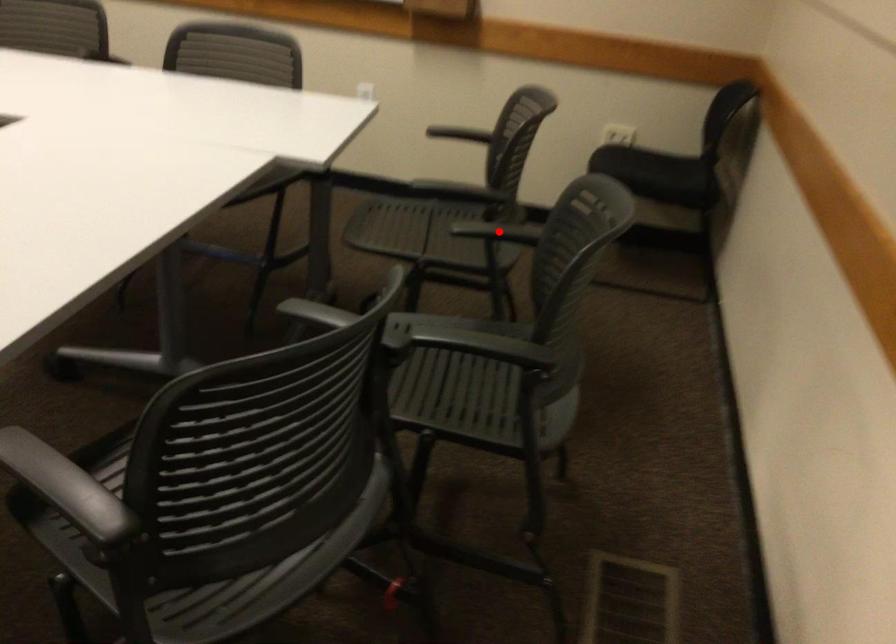
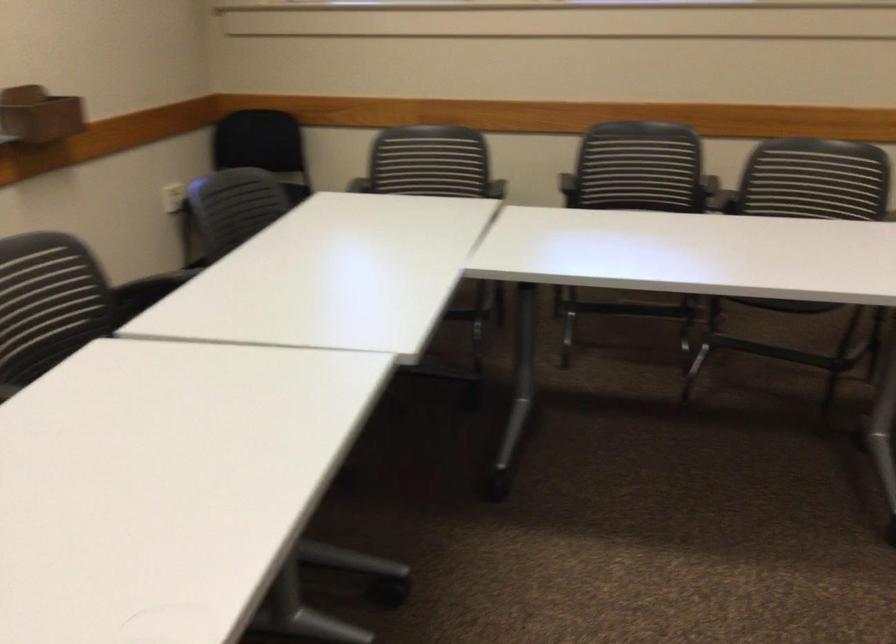
Question: I am providing you with two images of the same scene from different viewpoints. A red point is marked on the first image. Can you still see the location of the red point in image 2?

Choices:
 (A) Yes
 (B) No

Answer: (B)